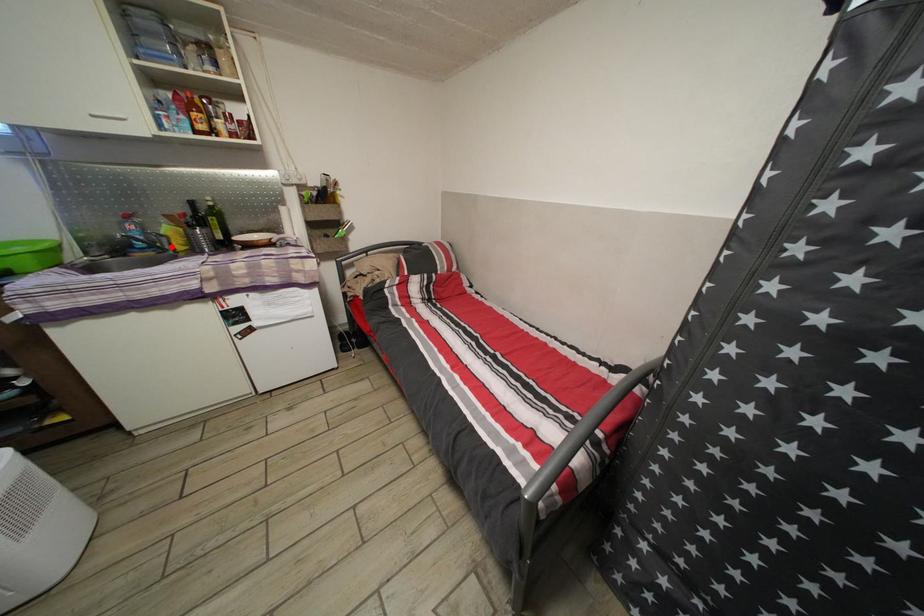
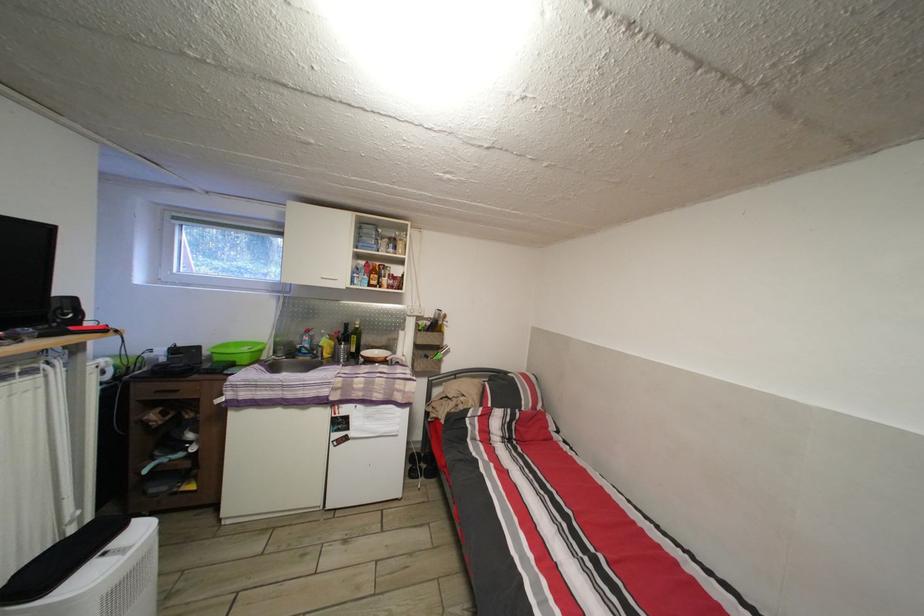
In the second image, find the point that corresponds to the highlighted location in the first image.

(327, 355)